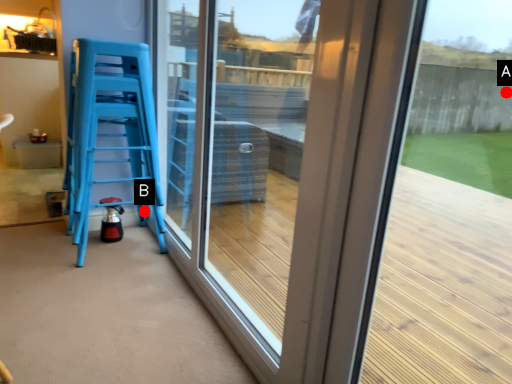
Question: Two points are circled on the image, labeled by A and B beside each circle. Among these points, which one is nearest to the camera?

Choices:
 (A) A is closer
 (B) B is closer

Answer: (B)